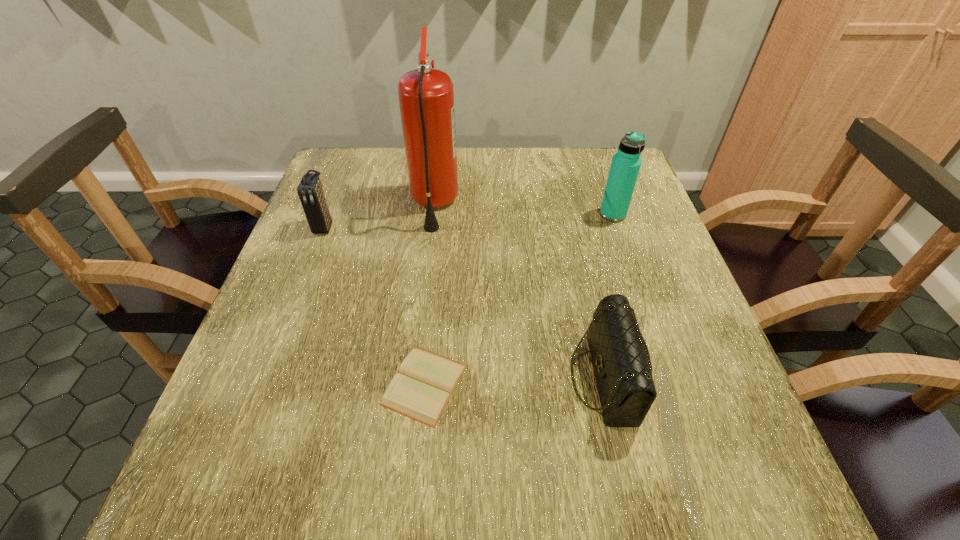
In order to click on the tallest object in this screenshot , I will do `click(426, 97)`.

Locate an element on the screen. Image resolution: width=960 pixels, height=540 pixels. the rightmost object is located at coordinates (626, 163).

This screenshot has height=540, width=960. Find the location of `the fourth shortest object`. the fourth shortest object is located at coordinates (626, 163).

You are a GUI agent. You are given a task and a screenshot of the screen. Output one action in this format:
    pyautogui.click(x=<x>, y=<y>)
    Task: Click on the taller clutch bag
    This screenshot has height=540, width=960.
    Given the screenshot: What is the action you would take?
    pyautogui.click(x=310, y=191)

I want to click on the left clutch bag, so click(310, 191).

Find the location of a particular element. This screenshot has width=960, height=540. the nearer clutch bag is located at coordinates (620, 357).

The image size is (960, 540). I want to click on the fourth tallest object, so click(620, 357).

Locate an element on the screen. The height and width of the screenshot is (540, 960). diary is located at coordinates (421, 390).

The image size is (960, 540). In order to click on vacant space located on the instruction side of the fire extinguisher in this screenshot , I will do tap(577, 205).

At what (x,y) coordinates should I click in order to perform the action: click on vacant region located on the left of the rightmost object. Please return your answer as a coordinate pair (x, y). The width and height of the screenshot is (960, 540). Looking at the image, I should click on (561, 214).